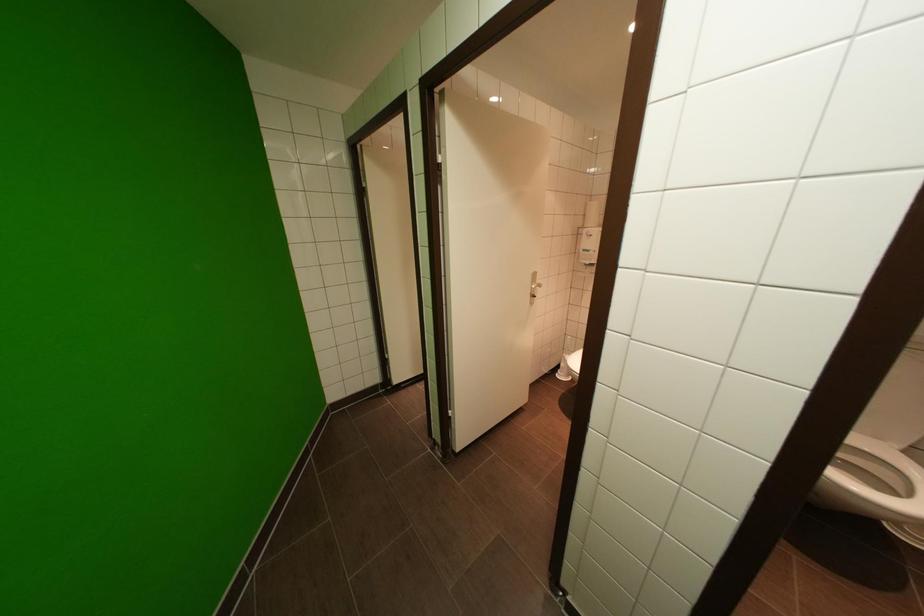
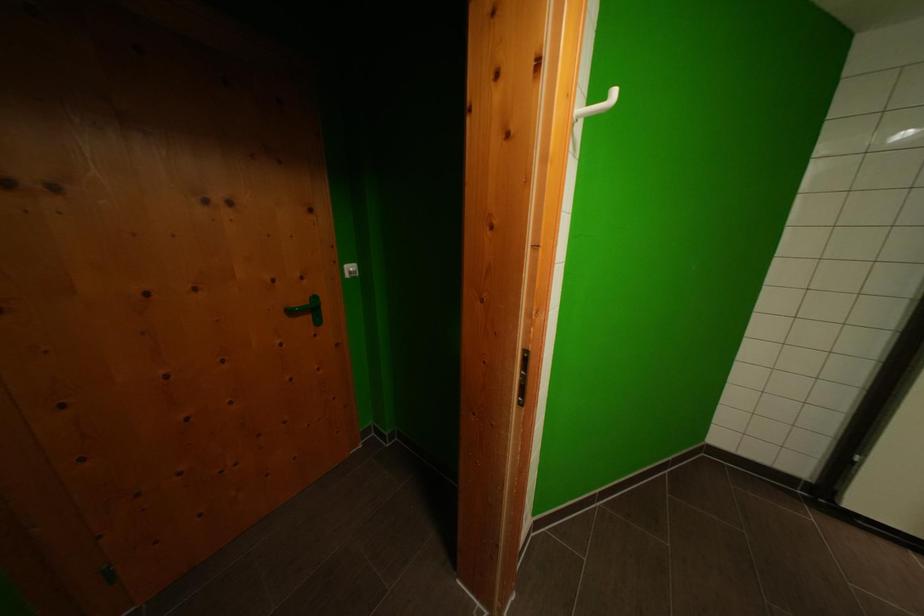
Question: Based on the continuous images, in which direction is the camera rotating? Reply with the corresponding letter.

Choices:
 (A) Left
 (B) Right
 (C) Up
 (D) Down

Answer: (A)